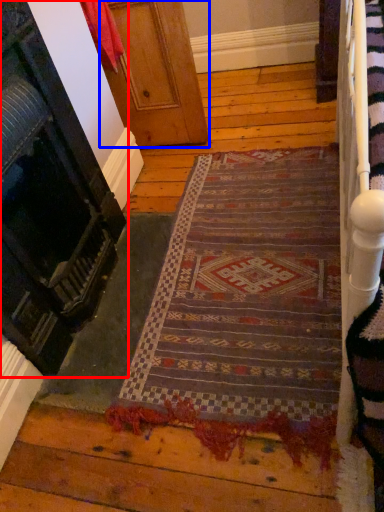
Question: Among these objects, which one is farthest to the camera, door (highlighted by a red box) or door (highlighted by a blue box)?

Choices:
 (A) door
 (B) door

Answer: (B)